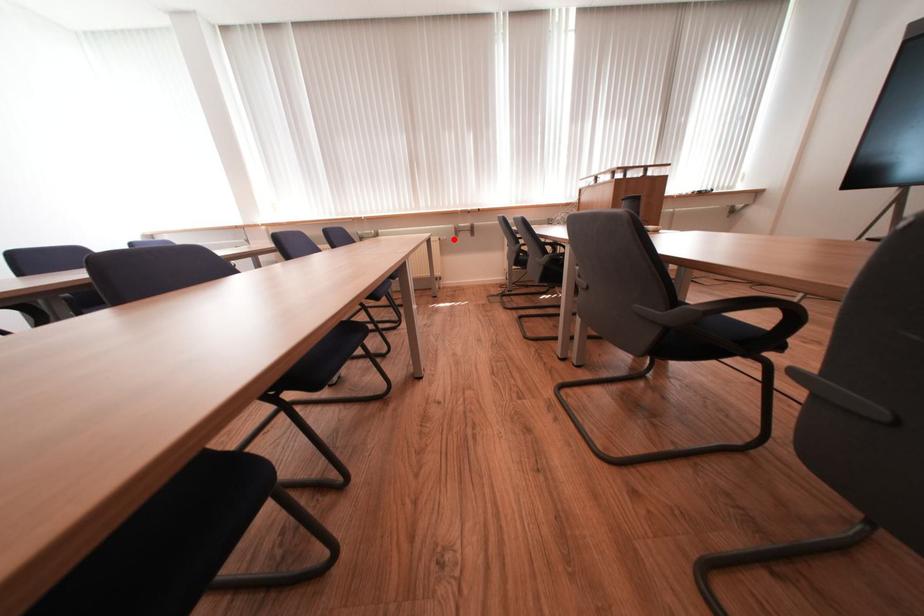
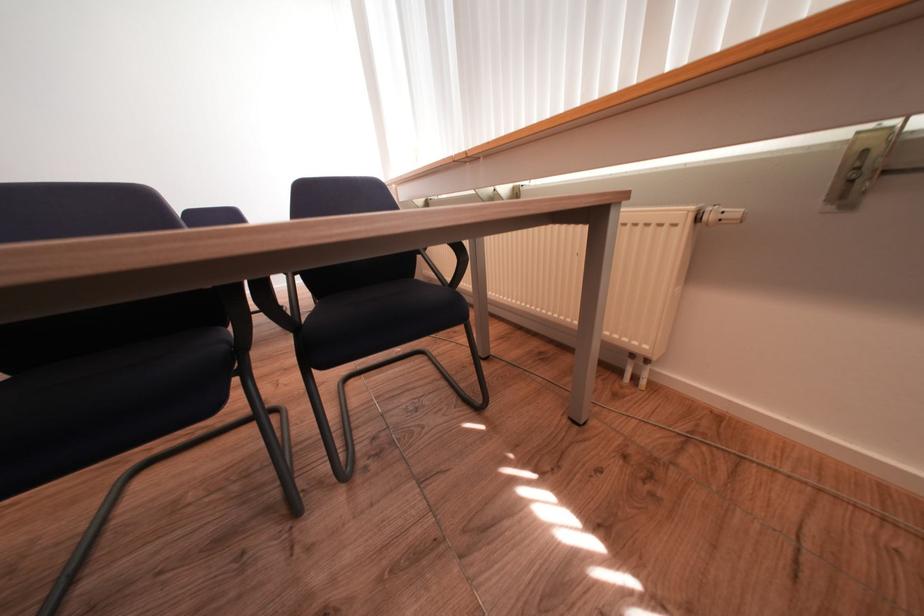
Question: A red point is marked in image1. In image2, is the corresponding 3D point closer to the camera or farther? Reply with the corresponding letter.

Choices:
 (A) The corresponding 3D point is closer.
 (B) The corresponding 3D point is farther.

Answer: (B)